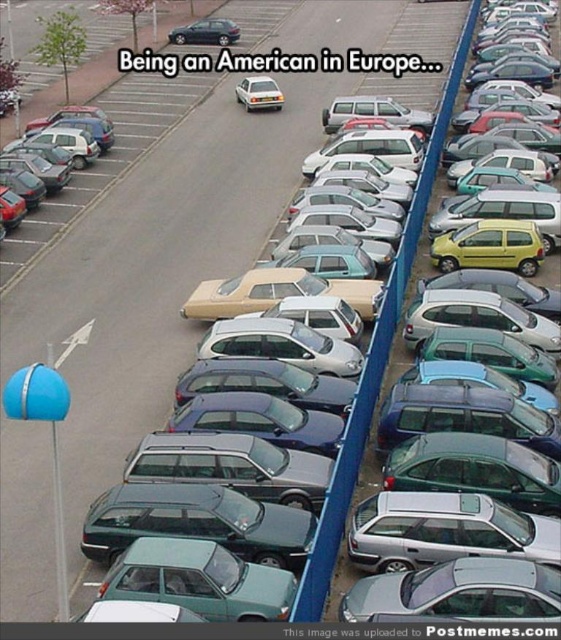
Who is taller, shiny metallic sedan at center or silver metallic hatchback at center?

Standing taller between the two is silver metallic hatchback at center.

Measure the distance between shiny metallic sedan at center and silver metallic hatchback at center.

They are 14.27 meters apart.

The height and width of the screenshot is (640, 561). Identify the location of shiny metallic sedan at center. (205, 33).

Is matte silver hatchback at center-right to the left of silver metallic hatchback at center from the viewer's perspective?

In fact, matte silver hatchback at center-right is to the right of silver metallic hatchback at center.

Locate an element on the screen. The height and width of the screenshot is (640, 561). matte silver hatchback at center-right is located at coordinates (396, 355).

Who is higher up, matte beige car at left or shiny metallic sedan at center?

shiny metallic sedan at center

Where is `matte beige car at left`? Image resolution: width=561 pixels, height=640 pixels. matte beige car at left is located at coordinates (67, 122).